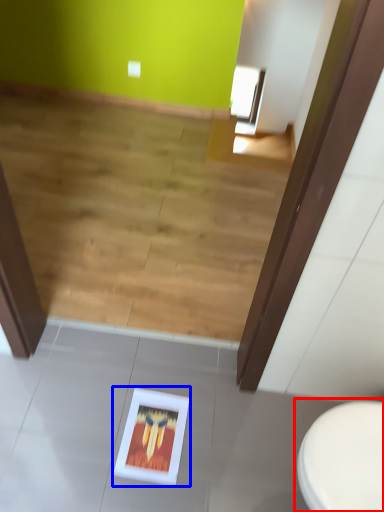
Question: Which object is further to the camera taking this photo, toilet (highlighted by a red box) or picture frame (highlighted by a blue box)?

Choices:
 (A) toilet
 (B) picture frame

Answer: (B)